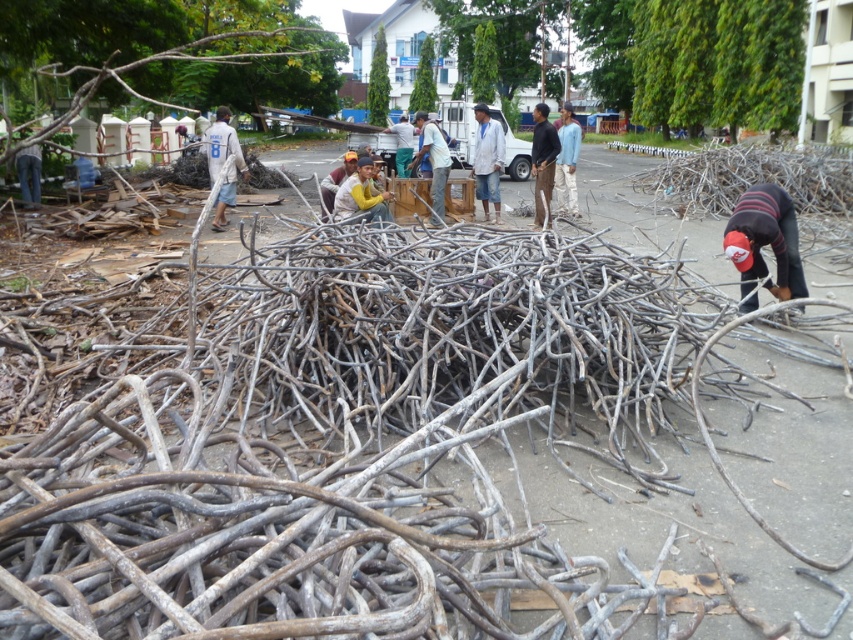
Does striped knit cap at lower right have a lesser width compared to light blue fabric shirt at center?

Correct, striped knit cap at lower right's width is less than light blue fabric shirt at center's.

Who is shorter, striped knit cap at lower right or light blue fabric shirt at center?

striped knit cap at lower right is shorter.

Image resolution: width=853 pixels, height=640 pixels. What do you see at coordinates (764, 243) in the screenshot? I see `striped knit cap at lower right` at bounding box center [764, 243].

Where is `striped knit cap at lower right`? The height and width of the screenshot is (640, 853). striped knit cap at lower right is located at coordinates (764, 243).

Is white fabric shirt at center smaller than light blue fabric shirt at center?

Yes.

Is white fabric shirt at center shorter than light blue fabric shirt at center?

Correct, white fabric shirt at center is not as tall as light blue fabric shirt at center.

Who is more forward, (209, 163) or (558, 163)?

Point (209, 163) is in front.

Locate an element on the screen. This screenshot has height=640, width=853. white fabric shirt at center is located at coordinates (223, 163).

In the scene shown: Is striped knit cap at lower right closer to camera compared to white fabric shirt at center?

Yes, striped knit cap at lower right is in front of white fabric shirt at center.

Which is in front, point (740, 294) or point (216, 221)?

Point (740, 294) is more forward.

At what (x,y) coordinates should I click in order to perform the action: click on striped knit cap at lower right. Please return your answer as a coordinate pair (x, y). This screenshot has width=853, height=640. Looking at the image, I should click on point(764,243).